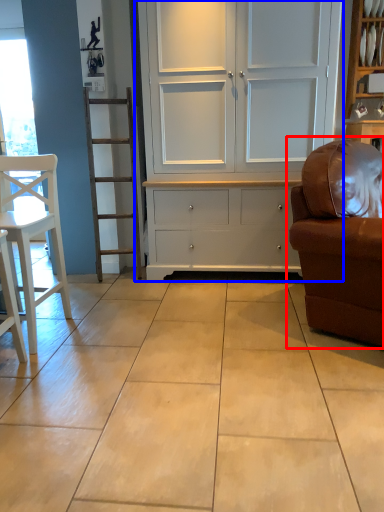
Question: Which object is further to the camera taking this photo, studio couch (highlighted by a red box) or cupboard (highlighted by a blue box)?

Choices:
 (A) studio couch
 (B) cupboard

Answer: (B)